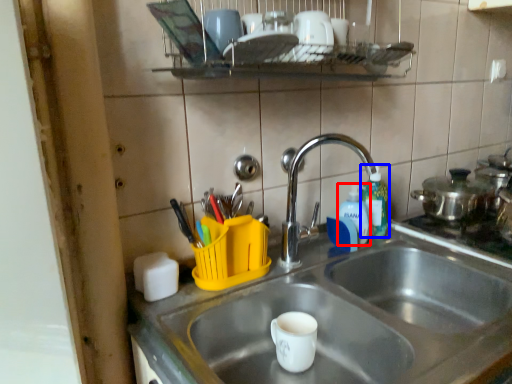
Question: Among these objects, which one is farthest to the camera, bottle (highlighted by a red box) or bottle (highlighted by a blue box)?

Choices:
 (A) bottle
 (B) bottle

Answer: (B)